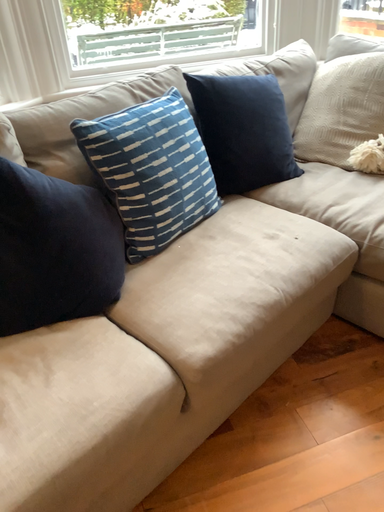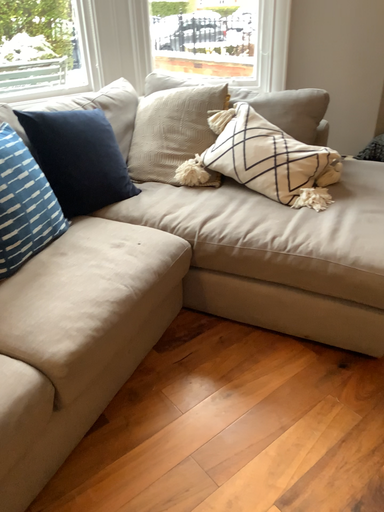
Question: How did the camera likely rotate when shooting the video?

Choices:
 (A) rotated right
 (B) rotated left

Answer: (A)